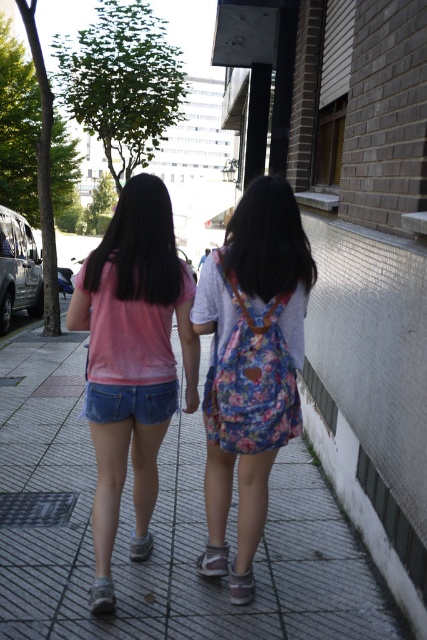
Based on the photo, you are a photographer trying to capture a photo of the two people walking. You want to ensure that both the floral fabric backpack at center and the denim shorts at center are clearly visible in the frame. Based on their positions, which object should you focus on first to ensure both are in focus?

The denim shorts at center should be focused on first because the floral fabric backpack at center is to the right of it, meaning they are further away from the camera. By focusing on the closer object, both will be in focus as the backpack is behind.

You are a photographer trying to capture a closeup of the gray concrete pavement at center and the white fabric sandal at center. Which object should you zoom in on to ensure it fills more of the frame?

The gray concrete pavement at center is larger in size than the white fabric sandal at center, so zooming in on the gray concrete pavement at center will fill the frame more.